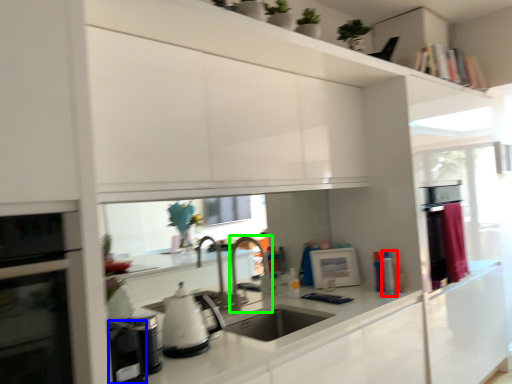
Question: Estimate the real-world distances between objects in this image. Which object is closer to appliance (highlighted by a red box), appliance (highlighted by a blue box) or faucet (highlighted by a green box)?

Choices:
 (A) appliance
 (B) faucet

Answer: (B)